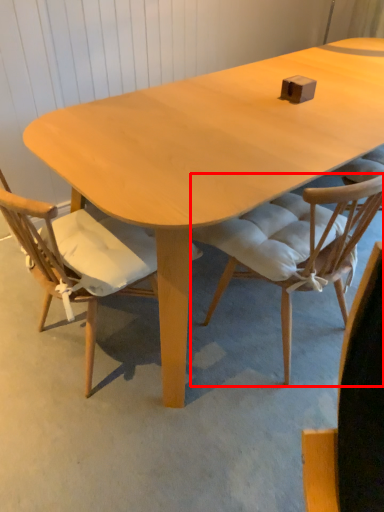
Question: Observing the image, what is the correct spatial positioning of chair (annotated by the red box) in reference to chair?

Choices:
 (A) left
 (B) right

Answer: (B)